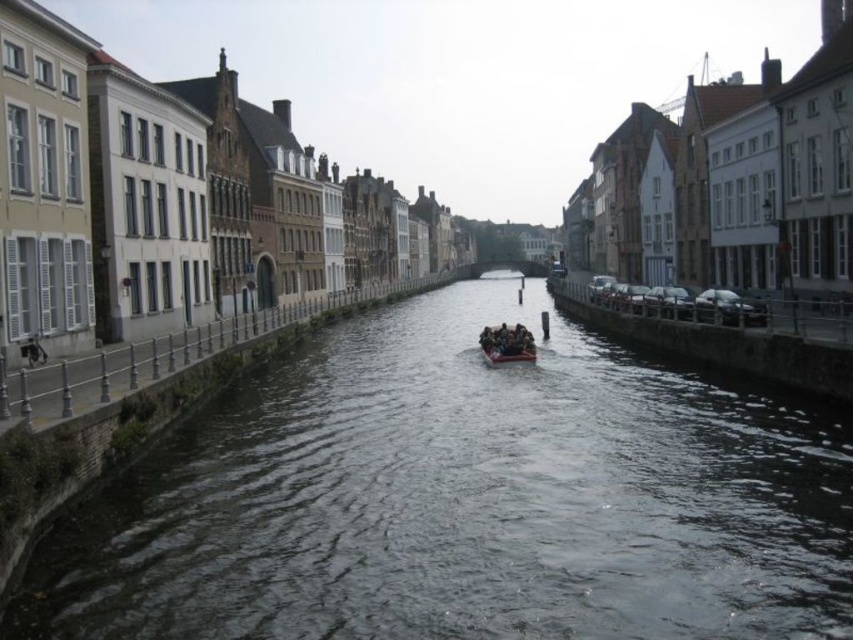
Is point (813, 528) farther from viewer compared to point (520, 358)?

That is False.

Can you confirm if dark water at center is shorter than brown wooden raft at center?

Incorrect, dark water at center's height does not fall short of brown wooden raft at center's.

Where is `dark water at center`? This screenshot has height=640, width=853. dark water at center is located at coordinates (463, 499).